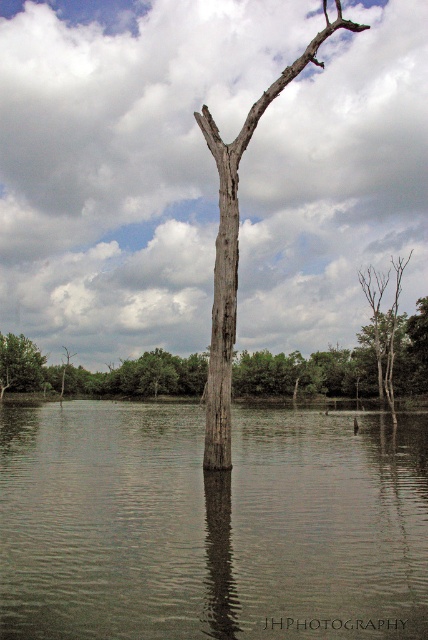
Question: Which point appears closest to the camera in this image?

Choices:
 (A) (2, 362)
 (B) (392, 348)
 (C) (55, 586)
 (D) (223, 220)

Answer: (C)

Question: Can you confirm if gray bark tree at center is bigger than bare wood tree at right?

Choices:
 (A) yes
 (B) no

Answer: (A)

Question: Which point is closer to the camera taking this photo?

Choices:
 (A) [x=92, y=605]
 (B) [x=395, y=348]

Answer: (A)

Question: Is brown matte tree trunk at center in front of green matte tree at left?

Choices:
 (A) no
 (B) yes

Answer: (B)

Question: From the image, what is the correct spatial relationship of gray bark tree at center in relation to bare wood tree at right?

Choices:
 (A) above
 (B) below

Answer: (A)

Question: Which is nearer to the bare wood tree at right?

Choices:
 (A) brown matte tree trunk at center
 (B) green matte tree at left
 (C) gray bark tree at center

Answer: (A)